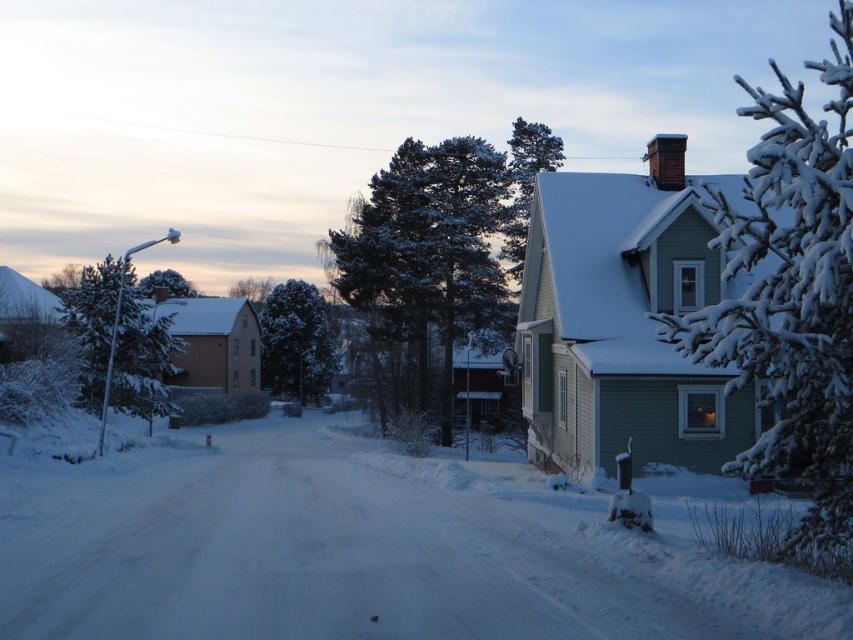
Question: Does white fluffy snow at center have a lesser width compared to green textured pine tree at upper center?

Choices:
 (A) yes
 (B) no

Answer: (B)

Question: Does snow-covered branches at upper right appear on the right side of snow-covered pine tree at center?

Choices:
 (A) no
 (B) yes

Answer: (B)

Question: Among these objects, which one is farthest from the camera?

Choices:
 (A) white fluffy snow at center
 (B) snow-covered branches at upper right
 (C) green textured tree at center

Answer: (C)

Question: Which of the following is the closest to the observer?

Choices:
 (A) (527, 202)
 (B) (126, 280)
 (C) (160, 276)

Answer: (B)

Question: Can you confirm if white fluffy snow at center is smaller than green textured pine tree at upper center?

Choices:
 (A) yes
 (B) no

Answer: (A)

Question: Among these objects, which one is farthest from the camera?

Choices:
 (A) green textured tree at upper left
 (B) snow-covered pine tree at center
 (C) snow-covered evergreen at left
 (D) green textured pine tree at upper center

Answer: (A)